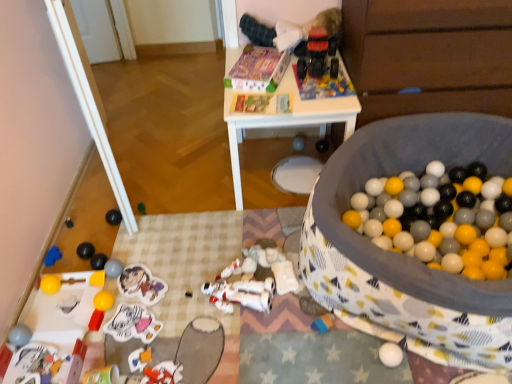
Identify the location of vacant space to the left of matte cardboard stickers at lower center, positioned as the 13th toy in left-to-right order. The image size is (512, 384). (102, 295).